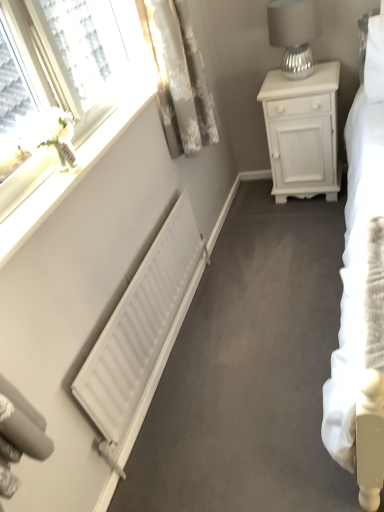
Describe the element at coordinates (294, 34) in the screenshot. I see `silver textured lampshade at upper right` at that location.

Image resolution: width=384 pixels, height=512 pixels. What do you see at coordinates (73, 54) in the screenshot?
I see `white glossy flower at upper left` at bounding box center [73, 54].

The width and height of the screenshot is (384, 512). Describe the element at coordinates (180, 77) in the screenshot. I see `white textured curtain at upper left` at that location.

Locate an element on the screen. The height and width of the screenshot is (512, 384). white matte radiator at lower left is located at coordinates (142, 330).

From the picture: Can you see white glossy flower at upper left touching white textured curtain at upper left?

white glossy flower at upper left and white textured curtain at upper left are clearly separated.

Is white glossy flower at upper left closer to camera compared to white textured curtain at upper left?

Yes.

Which of these two, white glossy flower at upper left or white textured curtain at upper left, stands shorter?

white glossy flower at upper left is shorter.

Is white glossy flower at upper left aimed at white textured curtain at upper left?

Yes.

Considering the sizes of objects silver textured lampshade at upper right and white textured curtain at upper left in the image provided, who is smaller, silver textured lampshade at upper right or white textured curtain at upper left?

With smaller size is silver textured lampshade at upper right.

Locate an element on the screen. curtain on the left of the silver textured lampshade at upper right is located at coordinates (180, 77).

How many degrees apart are the facing directions of silver textured lampshade at upper right and white textured curtain at upper left?

silver textured lampshade at upper right and white textured curtain at upper left are facing 88.9 degrees away from each other.

Could you tell me if silver textured lampshade at upper right is facing white textured curtain at upper left?

No, silver textured lampshade at upper right is not facing towards white textured curtain at upper left.

Which of these two, white matte radiator at lower left or white textured curtain at upper left, is wider?

Wider between the two is white textured curtain at upper left.

From their relative heights in the image, would you say white matte radiator at lower left is taller or shorter than white textured curtain at upper left?

In the image, white matte radiator at lower left appears to be shorter than white textured curtain at upper left.

From the image's perspective, is white matte radiator at lower left on white textured curtain at upper left?

Incorrect, from the image's perspective, white matte radiator at lower left is lower than white textured curtain at upper left.

Are white matte radiator at lower left and white textured curtain at upper left far apart?

No.

From the image's perspective, is white matte radiator at lower left above white glossy flower at upper left?

Actually, white matte radiator at lower left appears below white glossy flower at upper left in the image.

Who is shorter, white matte radiator at lower left or white glossy flower at upper left?

white glossy flower at upper left is shorter.

Considering the sizes of white matte radiator at lower left and white glossy flower at upper left in the image, is white matte radiator at lower left bigger or smaller than white glossy flower at upper left?

Clearly, white matte radiator at lower left is smaller in size than white glossy flower at upper left.

Is white glossy window sill at upper left spatially inside white glossy flower at upper left, or outside of it?

white glossy window sill at upper left is located inside white glossy flower at upper left.

Who is smaller, white glossy window sill at upper left or white glossy flower at upper left?

white glossy window sill at upper left is smaller.

Can you confirm if white glossy window sill at upper left is positioned to the left of white glossy flower at upper left?

No.

From a real-world perspective, which is physically above, white glossy window sill at upper left or white glossy flower at upper left?

From a 3D spatial view, white glossy flower at upper left is above.

I want to click on radiator located on the left of white matte nightstand at upper right, so click(x=142, y=330).

Considering the points (188, 240) and (324, 132), which point is in front, point (188, 240) or point (324, 132)?

The point (188, 240) is closer to the camera.

Which object is positioned more to the right, white matte radiator at lower left or white matte nightstand at upper right?

white matte nightstand at upper right.

Could you tell me if white matte radiator at lower left is turned towards white matte nightstand at upper right?

No, white matte radiator at lower left is not aimed at white matte nightstand at upper right.

Choose the correct answer: Is white textured curtain at upper left inside white matte radiator at lower left or outside it?

white textured curtain at upper left is outside white matte radiator at lower left.

Can you confirm if white textured curtain at upper left is bigger than white matte radiator at lower left?

Correct, white textured curtain at upper left is larger in size than white matte radiator at lower left.

This screenshot has height=512, width=384. I want to click on curtain above the white matte radiator at lower left (from a real-world perspective), so click(180, 77).

From the image's perspective, which one is positioned higher, white textured curtain at upper left or white matte radiator at lower left?

white textured curtain at upper left appears higher in the image.

Image resolution: width=384 pixels, height=512 pixels. Find the location of `curtain above the white glossy flower at upper left (from the image's perspective)`. curtain above the white glossy flower at upper left (from the image's perspective) is located at coordinates (180, 77).

This screenshot has width=384, height=512. Identify the location of table lamp located behind the white textured curtain at upper left. (294, 34).

Based on their spatial positions, is white textured curtain at upper left or silver textured lampshade at upper right closer to white glossy flower at upper left?

white textured curtain at upper left is closer to white glossy flower at upper left.

Based on their spatial positions, is silver textured lampshade at upper right or white matte nightstand at upper right closer to white matte radiator at lower left?

Based on the image, white matte nightstand at upper right appears to be nearer to white matte radiator at lower left.

Considering their positions, is white glossy window sill at upper left positioned closer to silver textured lampshade at upper right than white matte radiator at lower left?

white glossy window sill at upper left lies closer to silver textured lampshade at upper right than the other object.

Consider the image. Looking at the image, which one is located further to white glossy window sill at upper left, silver textured lampshade at upper right or white matte radiator at lower left?

silver textured lampshade at upper right is further to white glossy window sill at upper left.

When comparing their distances from white matte nightstand at upper right, does white textured curtain at upper left or white glossy flower at upper left seem closer?

white textured curtain at upper left is positioned closer to the anchor white matte nightstand at upper right.

Considering their positions, is white glossy window sill at upper left positioned further to white matte radiator at lower left than silver textured lampshade at upper right?

silver textured lampshade at upper right lies further to white matte radiator at lower left than the other object.

Based on their spatial positions, is white matte radiator at lower left or white matte nightstand at upper right further from white textured curtain at upper left?

Among the two, white matte radiator at lower left is located further to white textured curtain at upper left.

From the picture: Estimate the real-world distances between objects in this image. Which object is further from white glossy flower at upper left, white textured curtain at upper left or white glossy window sill at upper left?

white textured curtain at upper left is positioned further to the anchor white glossy flower at upper left.

This screenshot has width=384, height=512. Find the location of `radiator between white glossy window sill at upper left and white matte nightstand at upper right along the z-axis`. radiator between white glossy window sill at upper left and white matte nightstand at upper right along the z-axis is located at coordinates (142, 330).

The height and width of the screenshot is (512, 384). Identify the location of curtain between white glossy flower at upper left and white matte nightstand at upper right in the front-back direction. (180, 77).

Identify the location of curtain between silver textured lampshade at upper right and white matte radiator at lower left from top to bottom. The image size is (384, 512). (180, 77).

Where is `window between silver textured lampshade at upper right and white matte radiator at lower left from top to bottom`? window between silver textured lampshade at upper right and white matte radiator at lower left from top to bottom is located at coordinates (73, 54).